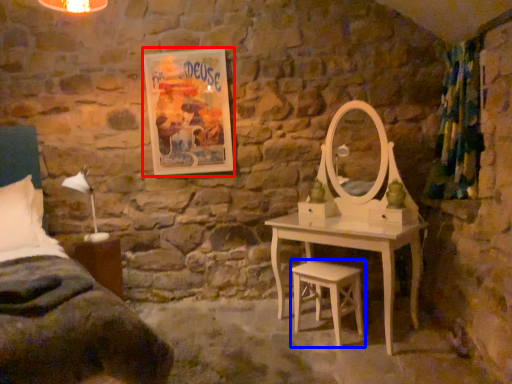
Question: Which point is further to the camera, picture frame (highlighted by a red box) or stool (highlighted by a blue box)?

Choices:
 (A) picture frame
 (B) stool

Answer: (A)